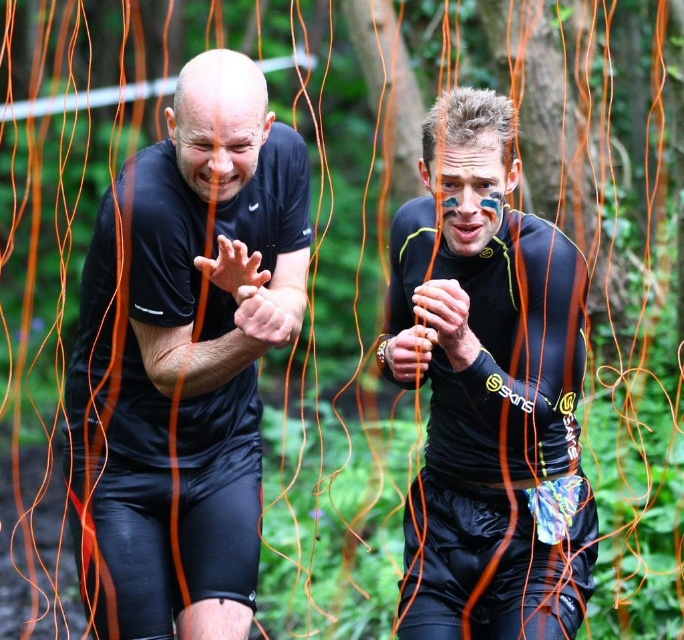
Which is more to the right, black matte shirt at left or matte black running suit at center?

matte black running suit at center is more to the right.

Can you confirm if black matte shirt at left is smaller than matte black running suit at center?

Actually, black matte shirt at left might be larger than matte black running suit at center.

Which is behind, point (213, 189) or point (523, 593)?

The point (523, 593) is more distant.

Locate an element on the screen. The image size is (684, 640). black matte shirt at left is located at coordinates (189, 349).